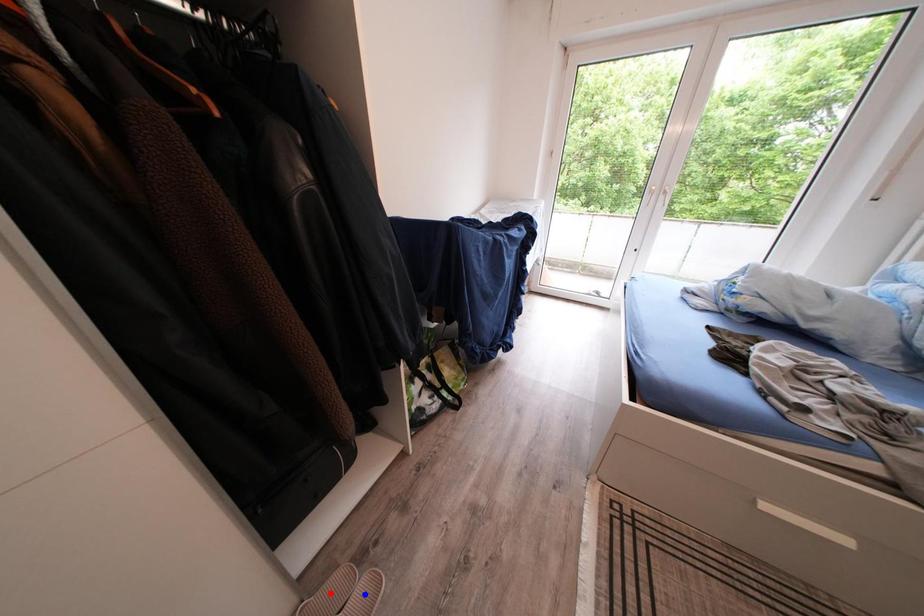
Question: Which of the two points in the image is closer to the camera?

Choices:
 (A) Blue point is closer.
 (B) Red point is closer.

Answer: (B)